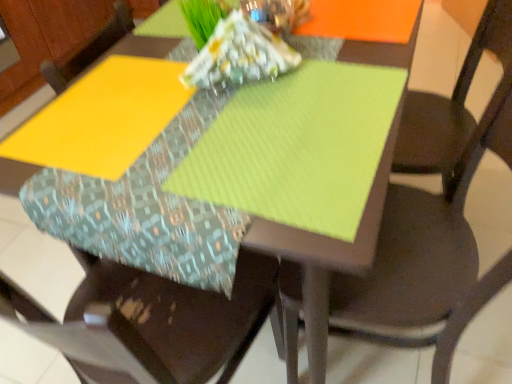
Describe the element at coordinates (436, 231) in the screenshot. The height and width of the screenshot is (384, 512). I see `matte brown chair at center, which ranks as the 1th chair in right-to-left order` at that location.

Measure the distance between point (x=468, y=264) and camera.

Point (x=468, y=264) and camera are 33.58 inches apart from each other.

This screenshot has width=512, height=384. Identify the location of matte brown chair at center, which ranks as the 1th chair in right-to-left order. (436, 231).

Measure the distance between fabric cushion at center, the 1th chair in the left-to-right sequence, and camera.

46.64 centimeters.

Find the location of a particular element. Image resolution: width=512 pixels, height=384 pixels. fabric cushion at center, the 1th chair in the left-to-right sequence is located at coordinates (155, 323).

This screenshot has width=512, height=384. What do you see at coordinates (155, 323) in the screenshot?
I see `fabric cushion at center, placed as the second chair when sorted from right to left` at bounding box center [155, 323].

Where is `matte brown chair at center, the 2th chair from the left`? The image size is (512, 384). matte brown chair at center, the 2th chair from the left is located at coordinates (436, 231).

Does fabric cushion at center, the 1th chair in the left-to-right sequence, appear on the left side of matte brown chair at center, which ranks as the 1th chair in right-to-left order?

Yes, fabric cushion at center, the 1th chair in the left-to-right sequence, is to the left of matte brown chair at center, which ranks as the 1th chair in right-to-left order.

Considering the positions of objects fabric cushion at center, the 1th chair in the left-to-right sequence, and matte brown chair at center, the 2th chair from the left, in the image provided, who is in front, fabric cushion at center, the 1th chair in the left-to-right sequence, or matte brown chair at center, the 2th chair from the left,?

fabric cushion at center, the 1th chair in the left-to-right sequence, is in front.

Which point is more distant from viewer, (x=169, y=295) or (x=391, y=185)?

The point (x=391, y=185) is farther from the camera.

From the image's perspective, who appears lower, fabric cushion at center, the 1th chair in the left-to-right sequence, or matte brown chair at center, which ranks as the 1th chair in right-to-left order?

fabric cushion at center, the 1th chair in the left-to-right sequence, from the image's perspective.

From a real-world perspective, which is physically above, fabric cushion at center, placed as the second chair when sorted from right to left, or matte brown chair at center, the 2th chair from the left?

In real-world perspective, matte brown chair at center, the 2th chair from the left, is above.

Looking at this image, is fabric cushion at center, the 1th chair in the left-to-right sequence, wider or thinner than matte brown chair at center, the 2th chair from the left?

Clearly, fabric cushion at center, the 1th chair in the left-to-right sequence, has less width compared to matte brown chair at center, the 2th chair from the left.

Considering the sizes of objects fabric cushion at center, the 1th chair in the left-to-right sequence, and matte brown chair at center, the 2th chair from the left, in the image provided, who is shorter, fabric cushion at center, the 1th chair in the left-to-right sequence, or matte brown chair at center, the 2th chair from the left,?

matte brown chair at center, the 2th chair from the left.

Does fabric cushion at center, the 1th chair in the left-to-right sequence, have a larger size compared to matte brown chair at center, which ranks as the 1th chair in right-to-left order?

Indeed, fabric cushion at center, the 1th chair in the left-to-right sequence, has a larger size compared to matte brown chair at center, which ranks as the 1th chair in right-to-left order.

Is matte brown chair at center, which ranks as the 1th chair in right-to-left order, inside fabric cushion at center, the 1th chair in the left-to-right sequence?

No, matte brown chair at center, which ranks as the 1th chair in right-to-left order, is not surrounded by fabric cushion at center, the 1th chair in the left-to-right sequence.

Is the surface of fabric cushion at center, placed as the second chair when sorted from right to left, in direct contact with matte brown chair at center, the 2th chair from the left?

No, fabric cushion at center, placed as the second chair when sorted from right to left, is not touching matte brown chair at center, the 2th chair from the left.

Is fabric cushion at center, the 1th chair in the left-to-right sequence, turned away from matte brown chair at center, which ranks as the 1th chair in right-to-left order?

No, fabric cushion at center, the 1th chair in the left-to-right sequence,'s orientation is not away from matte brown chair at center, which ranks as the 1th chair in right-to-left order.

What's the angular difference between fabric cushion at center, the 1th chair in the left-to-right sequence, and matte brown chair at center, the 2th chair from the left,'s facing directions?

The angle between the facing direction of fabric cushion at center, the 1th chair in the left-to-right sequence, and the facing direction of matte brown chair at center, the 2th chair from the left, is 106 degrees.

Locate an element on the screen. Image resolution: width=512 pixels, height=384 pixels. chair below the matte brown chair at center, the 2th chair from the left (from the image's perspective) is located at coordinates (155, 323).

Consider the image. Considering the relative positions of matte brown chair at center, the 2th chair from the left, and fabric cushion at center, placed as the second chair when sorted from right to left, in the image provided, is matte brown chair at center, the 2th chair from the left, to the right of fabric cushion at center, placed as the second chair when sorted from right to left, from the viewer's perspective?

Correct, you'll find matte brown chair at center, the 2th chair from the left, to the right of fabric cushion at center, placed as the second chair when sorted from right to left.

Does matte brown chair at center, which ranks as the 1th chair in right-to-left order, lie behind fabric cushion at center, placed as the second chair when sorted from right to left?

Yes, matte brown chair at center, which ranks as the 1th chair in right-to-left order, is further from the camera.

Is point (398, 275) less distant than point (244, 320)?

No, it is behind (244, 320).

From the image's perspective, is matte brown chair at center, the 2th chair from the left, located above or below fabric cushion at center, the 1th chair in the left-to-right sequence?

matte brown chair at center, the 2th chair from the left, is above fabric cushion at center, the 1th chair in the left-to-right sequence.

From the picture: From a real-world perspective, is matte brown chair at center, which ranks as the 1th chair in right-to-left order, on fabric cushion at center, placed as the second chair when sorted from right to left?

Yes, from a real-world perspective, matte brown chair at center, which ranks as the 1th chair in right-to-left order, is above fabric cushion at center, placed as the second chair when sorted from right to left.

Looking at their sizes, would you say matte brown chair at center, the 2th chair from the left, is wider or thinner than fabric cushion at center, placed as the second chair when sorted from right to left?

In the image, matte brown chair at center, the 2th chair from the left, appears to be wider than fabric cushion at center, placed as the second chair when sorted from right to left.

Is matte brown chair at center, the 2th chair from the left, shorter than fabric cushion at center, the 1th chair in the left-to-right sequence?

Indeed, matte brown chair at center, the 2th chair from the left, has a lesser height compared to fabric cushion at center, the 1th chair in the left-to-right sequence.

Between matte brown chair at center, the 2th chair from the left, and fabric cushion at center, placed as the second chair when sorted from right to left, which one has smaller size?

Smaller between the two is matte brown chair at center, the 2th chair from the left.

Does matte brown chair at center, the 2th chair from the left, contain fabric cushion at center, the 1th chair in the left-to-right sequence?

Definitely not — fabric cushion at center, the 1th chair in the left-to-right sequence, is not inside matte brown chair at center, the 2th chair from the left.

Are matte brown chair at center, the 2th chair from the left, and fabric cushion at center, placed as the second chair when sorted from right to left, far apart?

They are positioned close to each other.

Is matte brown chair at center, which ranks as the 1th chair in right-to-left order, facing towards fabric cushion at center, placed as the second chair when sorted from right to left?

Yes, matte brown chair at center, which ranks as the 1th chair in right-to-left order, is aimed at fabric cushion at center, placed as the second chair when sorted from right to left.

You are a GUI agent. You are given a task and a screenshot of the screen. Output one action in this format:
    pyautogui.click(x=<x>, y=<y>)
    Task: Click on the chair below the matte brown chair at center, the 2th chair from the left (from the image's perspective)
    The image size is (512, 384).
    Given the screenshot: What is the action you would take?
    pyautogui.click(x=155, y=323)

At what (x,y) coordinates should I click in order to perform the action: click on chair on the left of the matte brown chair at center, the 2th chair from the left. Please return your answer as a coordinate pair (x, y). This screenshot has width=512, height=384. Looking at the image, I should click on (155, 323).

The width and height of the screenshot is (512, 384). In the image, there is a matte brown chair at center, the 2th chair from the left. Find the location of `chair below it (from the image's perspective)`. chair below it (from the image's perspective) is located at coordinates (155, 323).